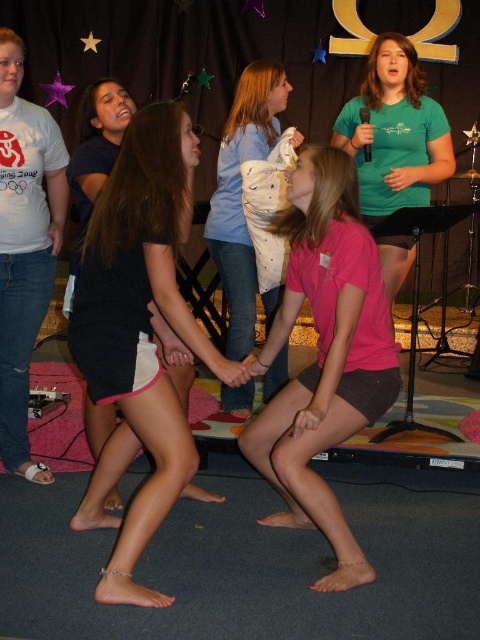
Question: Can you confirm if pink matte shorts at center is positioned above white dotted shirt at center?

Choices:
 (A) yes
 (B) no

Answer: (B)

Question: Which of these objects is positioned closest to the white dotted shirt at center?

Choices:
 (A) pink matte shorts at center
 (B) white fabric shorts at center

Answer: (A)

Question: Does white fabric shorts at center have a lesser width compared to pink matte shorts at center?

Choices:
 (A) yes
 (B) no

Answer: (B)

Question: Which object is farther from the camera taking this photo?

Choices:
 (A) white dotted shirt at center
 (B) pink matte shorts at center
 (C) white fabric shorts at center

Answer: (A)

Question: Which point is closer to the camera?

Choices:
 (A) white fabric shorts at center
 (B) white dotted shirt at center
 (C) pink matte shorts at center

Answer: (A)

Question: Can you confirm if pink matte shorts at center is positioned above white dotted shirt at center?

Choices:
 (A) yes
 (B) no

Answer: (B)